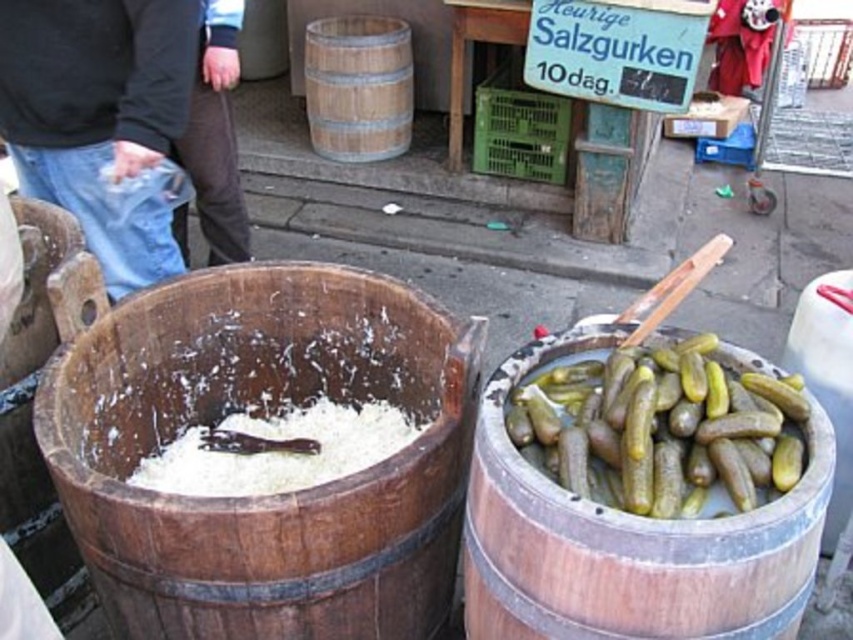
You are a customer at the outdoor market and want to buy pickled cucumbers. The vendor points to the sign at point (627, 540). Which barrel should you look at?

The vendor is pointing to the wooden barrel at right, so you should look at the wooden barrel at right to buy pickled cucumbers.

You are a customer at the market and want to buy both the jeans at left and the brown leather pants at center. The vendor says you can only take one due to a size restriction. Which item should you choose based on their sizes?

The jeans at left is larger in size than the brown leather pants at center, so you should choose the jeans at left since it takes up more space and meets the size restriction.

Looking at this image, what is the exact location of the jeans at left in the image?

The jeans at left are located at point (102, 120).